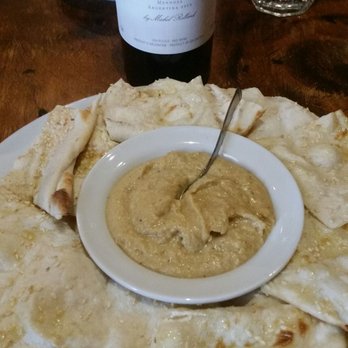
What are the coordinates of `white lip of bowl` in the screenshot? It's located at (248, 279).